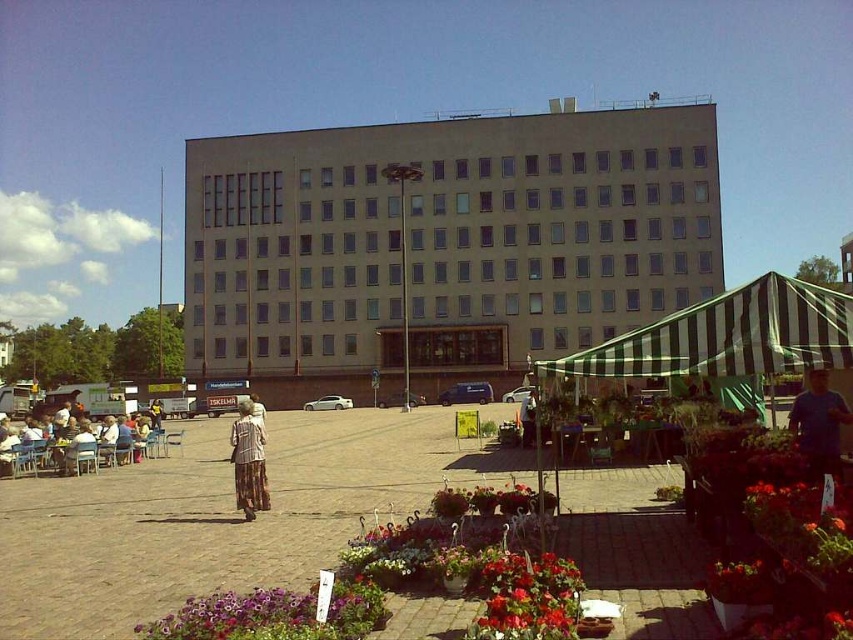
You are a customer at the flower market and want to take a photo of the floral vibrant pots at lower center without any obstructions. Since the green striped canopy at right is nearby, will the canopy block the view of the pots?

The floral vibrant pots at lower center are shorter than the green striped canopy at right, so the canopy might block the view unless you position yourself lower or move the pots to a clearer spot.